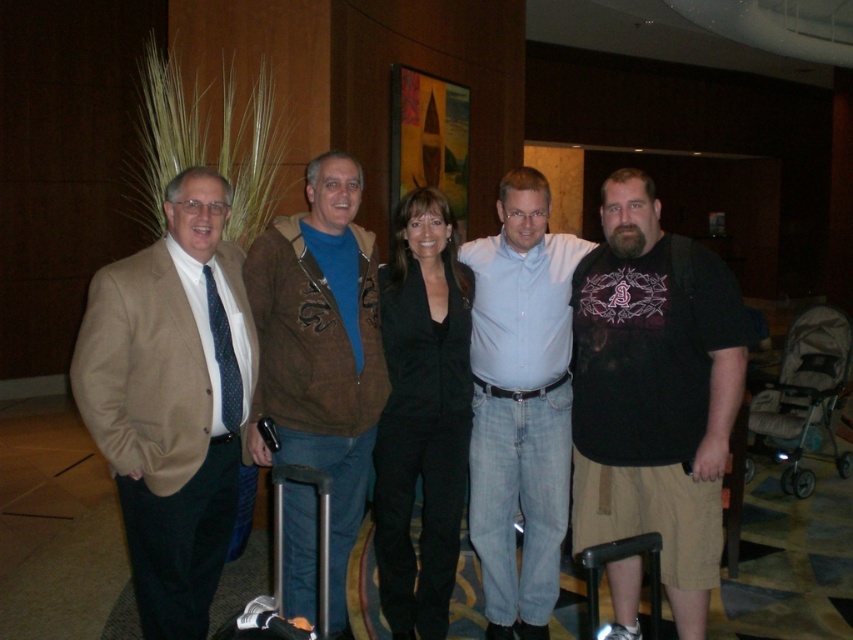
Does beige textured blazer at left come behind black hard suitcase at lower right?

Yes, beige textured blazer at left is further from the viewer.

Is point (160, 470) farther from viewer compared to point (589, 595)?

Yes, point (160, 470) is farther from viewer.

Describe the element at coordinates (172, 400) in the screenshot. The width and height of the screenshot is (853, 640). I see `beige textured blazer at left` at that location.

Locate an element on the screen. This screenshot has width=853, height=640. beige textured blazer at left is located at coordinates (172, 400).

Can you confirm if beige textured blazer at left is positioned below brown leather jacket at center?

Correct, beige textured blazer at left is located below brown leather jacket at center.

Which is more to the right, beige textured blazer at left or brown leather jacket at center?

Positioned to the right is brown leather jacket at center.

At what (x,y) coordinates should I click in order to perform the action: click on beige textured blazer at left. Please return your answer as a coordinate pair (x, y). This screenshot has width=853, height=640. Looking at the image, I should click on (172, 400).

The width and height of the screenshot is (853, 640). Identify the location of beige textured blazer at left. (172, 400).

Does light blue button-down shirt at center appear over black hard suitcase at lower right?

Yes, light blue button-down shirt at center is above black hard suitcase at lower right.

Is the position of light blue button-down shirt at center less distant than that of black hard suitcase at lower right?

No, it is behind black hard suitcase at lower right.

Who is more forward, (488, 502) or (589, 589)?

Positioned in front is point (589, 589).

You are a GUI agent. You are given a task and a screenshot of the screen. Output one action in this format:
    pyautogui.click(x=<x>, y=<y>)
    Task: Click on the light blue button-down shirt at center
    
    Given the screenshot: What is the action you would take?
    pyautogui.click(x=520, y=404)